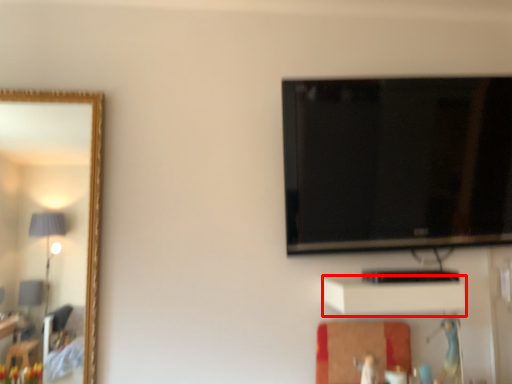
Question: Observing the image, what is the correct spatial positioning of cabinet (annotated by the red box) in reference to television?

Choices:
 (A) left
 (B) right

Answer: (A)